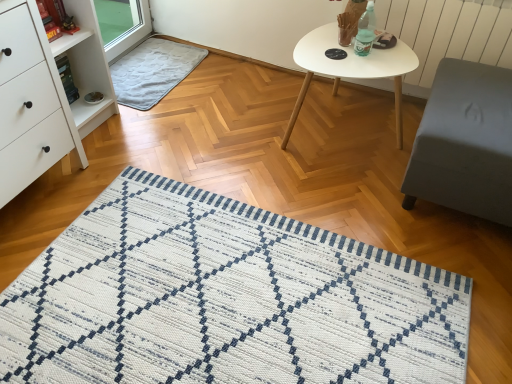
This screenshot has width=512, height=384. Identify the location of free area in between white matte chest of drawers at left and white matte oval table at upper center. (201, 156).